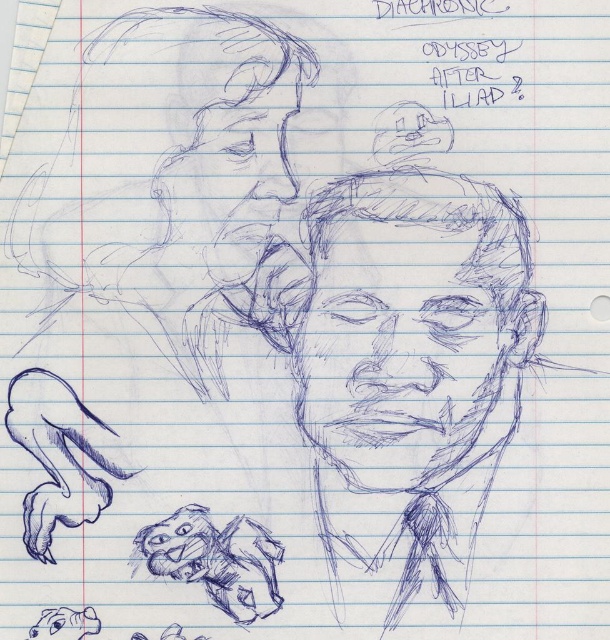
Is blue pencil sketch face at center shorter than blue sketchy face at upper left?

Yes.

Is blue pencil sketch face at center to the left of blue sketchy face at upper left from the viewer's perspective?

Incorrect, blue pencil sketch face at center is not on the left side of blue sketchy face at upper left.

Which is in front, point (406, 260) or point (201, 154)?

Point (201, 154) is more forward.

You are a GUI agent. You are given a task and a screenshot of the screen. Output one action in this format:
    pyautogui.click(x=<x>, y=<y>)
    Task: Click on the blue pencil sketch face at center
    
    Given the screenshot: What is the action you would take?
    pyautogui.click(x=404, y=352)